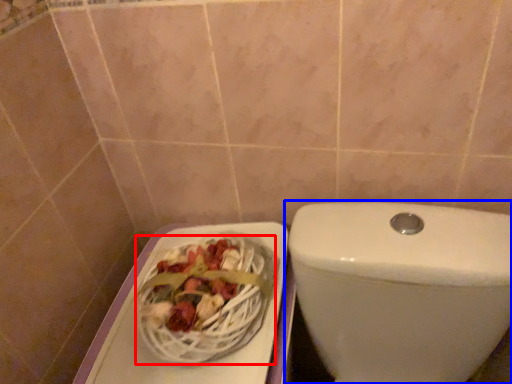
Question: Which point is closer to the camera, basket (highlighted by a red box) or toilet (highlighted by a blue box)?

Choices:
 (A) basket
 (B) toilet

Answer: (B)